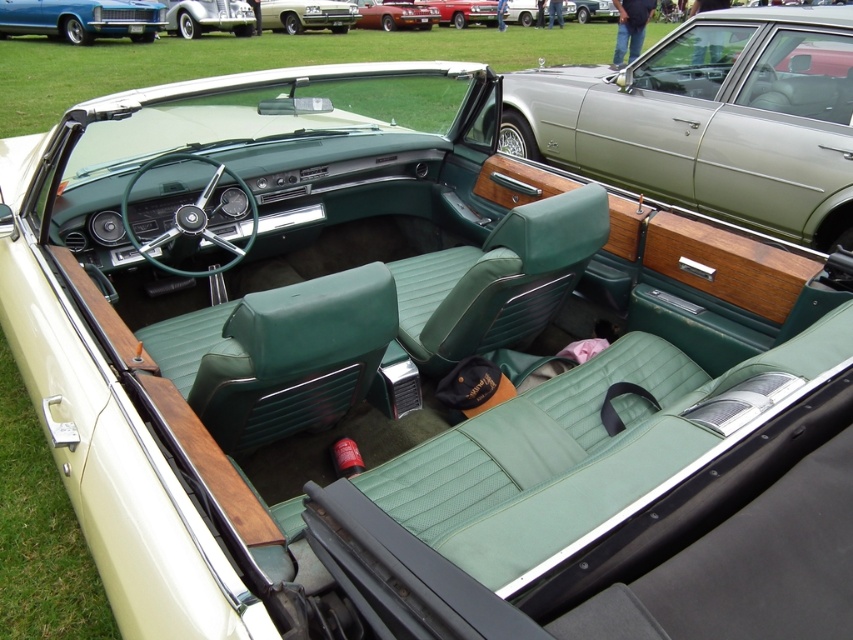
This screenshot has width=853, height=640. Find the location of `shiny silver car at upper left`. shiny silver car at upper left is located at coordinates (207, 17).

The width and height of the screenshot is (853, 640). Find the location of `shiny silver car at upper left`. shiny silver car at upper left is located at coordinates (207, 17).

Describe the element at coordinates (207, 17) in the screenshot. I see `shiny silver car at upper left` at that location.

Does shiny silver car at upper left have a lesser height compared to metallic silver sedan at center?

Incorrect, shiny silver car at upper left's height does not fall short of metallic silver sedan at center's.

Where is `shiny silver car at upper left`? This screenshot has width=853, height=640. shiny silver car at upper left is located at coordinates (207, 17).

Can you confirm if green leather seats at center is smaller than shiny silver car at upper left?

No, green leather seats at center is not smaller than shiny silver car at upper left.

Is point (637, 132) farther from camera compared to point (171, 33)?

No.

Where is `green leather seats at center`? green leather seats at center is located at coordinates (711, 120).

You are a GUI agent. You are given a task and a screenshot of the screen. Output one action in this format:
    pyautogui.click(x=<x>, y=<y>)
    Task: Click on the green leather seats at center
    
    Given the screenshot: What is the action you would take?
    pyautogui.click(x=711, y=120)